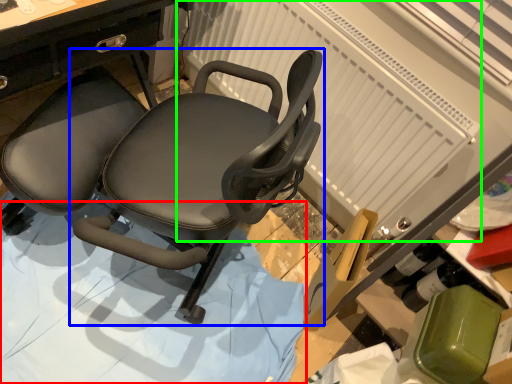
Question: Based on their relative distances, which object is nearer to surface (highlighted by a red box)? Choose from chair (highlighted by a blue box) and radiator (highlighted by a green box).

Choices:
 (A) chair
 (B) radiator

Answer: (A)